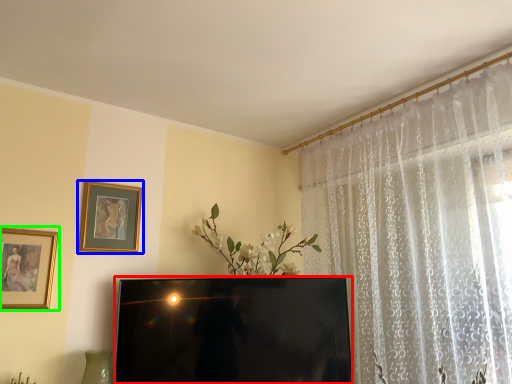
Question: Based on their relative distances, which object is farther from television (highlighted by a red box)? Choose from picture frame (highlighted by a blue box) and picture frame (highlighted by a green box).

Choices:
 (A) picture frame
 (B) picture frame

Answer: (B)